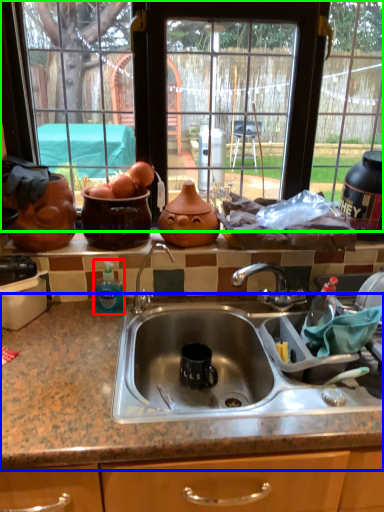
Question: Considering the real-world distances, which object is farthest from bottle (highlighted by a red box)? countertop (highlighted by a blue box) or window (highlighted by a green box)?

Choices:
 (A) countertop
 (B) window

Answer: (B)